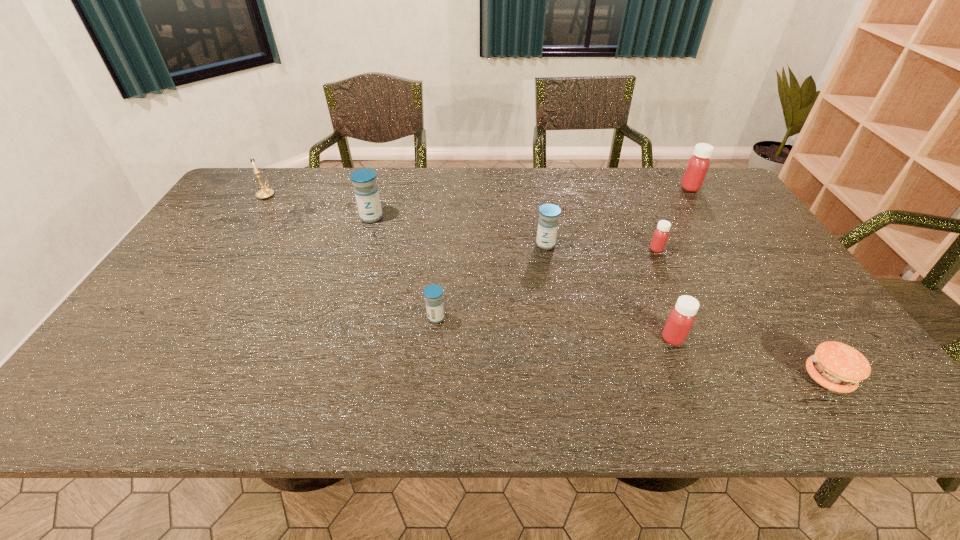
At what (x,y) coordinates should I click in order to perform the action: click on object that can be found as the closest to the second farthest blue medicine. Please return your answer as a coordinate pair (x, y). The width and height of the screenshot is (960, 540). Looking at the image, I should click on (660, 236).

Locate an element on the screen. the fourth closest object to the second nearest red medicine is located at coordinates (838, 367).

Point out which medicine is positioned as the second nearest to the second object from left to right. Please provide its 2D coordinates. Your answer should be formatted as a tuple, i.e. [(x, y)], where the tuple contains the x and y coordinates of a point satisfying the conditions above.

[(548, 222)]

Identify the location of medicine that stands as the fourth closest to the third object from right to left. The height and width of the screenshot is (540, 960). [433, 293].

You are a GUI agent. You are given a task and a screenshot of the screen. Output one action in this format:
    pyautogui.click(x=<x>, y=<y>)
    Task: Click on the red medicine that is the second closest one to the nearest object
    The image size is (960, 540).
    Given the screenshot: What is the action you would take?
    pyautogui.click(x=660, y=236)

Locate which red medicine ranks second in proximity to the shortest object. Please provide its 2D coordinates. Your answer should be formatted as a tuple, i.e. [(x, y)], where the tuple contains the x and y coordinates of a point satisfying the conditions above.

[(660, 236)]

The image size is (960, 540). Identify the location of blue medicine that stands as the closest to the rightmost red medicine. (548, 222).

Find the location of a particular element. The image size is (960, 540). blue medicine object that ranks as the closest to the third object from left to right is located at coordinates (548, 222).

What are the coordinates of `vacant point that satisfies the following two spatial constraints: 1. on the front side of the farthest blue medicine; 2. on the right side of the sixth object from right to left` in the screenshot? It's located at (341, 318).

Image resolution: width=960 pixels, height=540 pixels. In order to click on free space in the image that satisfies the following two spatial constraints: 1. on the front side of the third object from right to left; 2. on the left side of the rightmost blue medicine in this screenshot , I will do `click(546, 249)`.